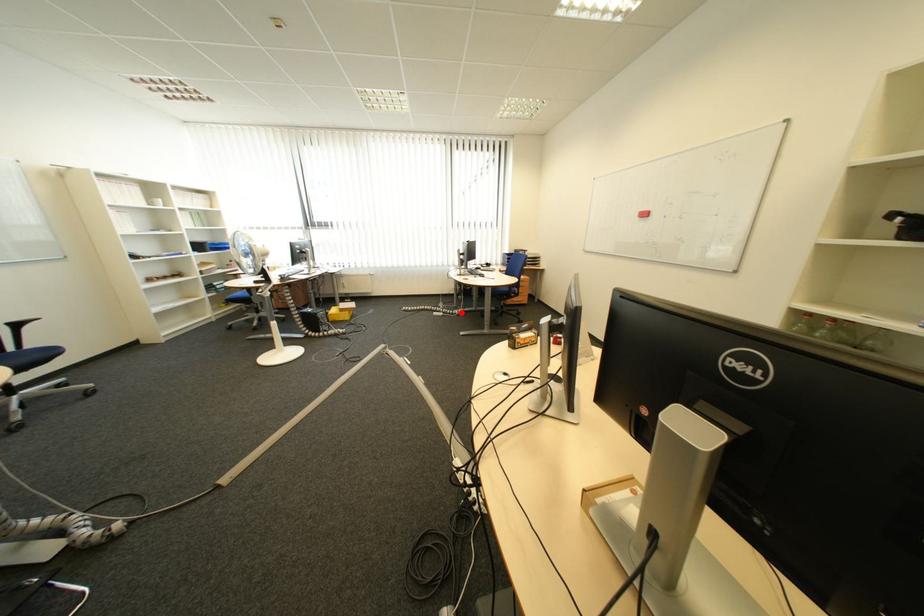
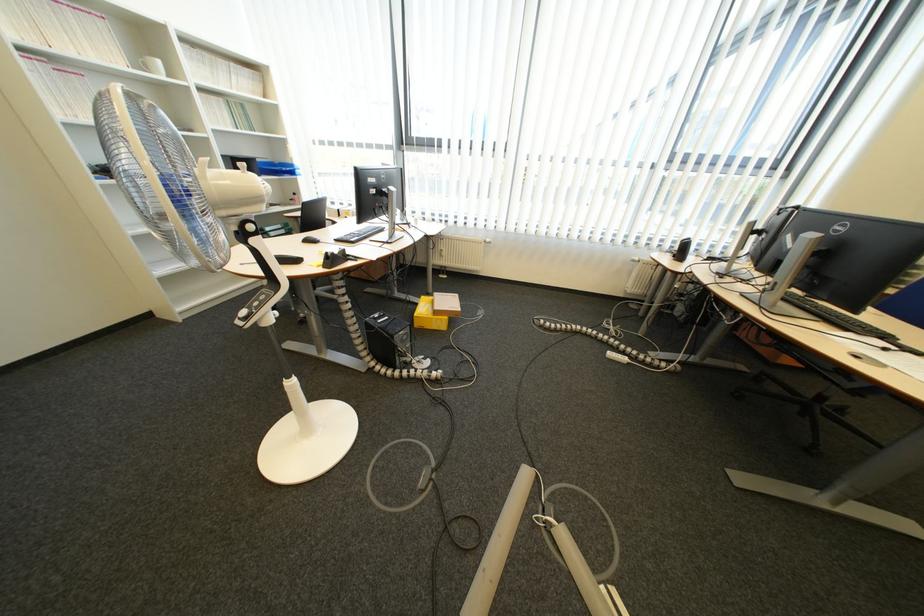
The point at the highlighted location is marked in the first image. Where is the corresponding point in the second image?

(654, 358)